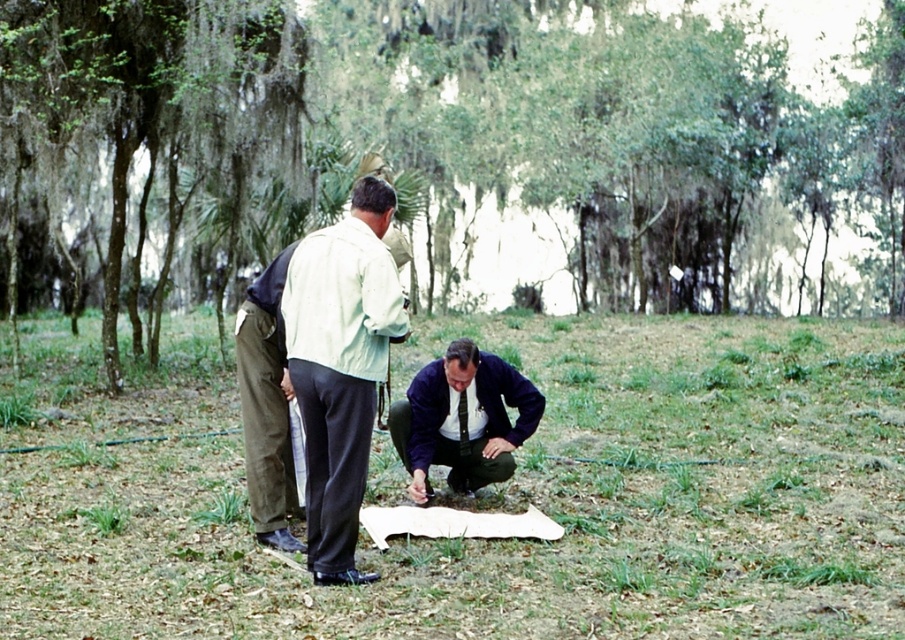
You are a hiker trying to determine if you can safely pass between the green mossy tree at center and the khaki cotton pants at center. Based on their heights, can you estimate if there is enough vertical clearance for your head?

The green mossy tree at center is taller than the khaki cotton pants at center, so there should be sufficient vertical clearance for your head as the tree is higher.

You are a hiker trying to locate a hidden treasure marked on a map. The treasure is buried exactly where the dark blue fabric at lower center and the green mossy tree at center are aligned. From your current position, which object should you move towards first to ensure proper alignment?

You should move towards the green mossy tree at center first because the dark blue fabric at lower center is behind it, so aligning them would require positioning yourself in front of the green mossy tree at center to see both objects in line.